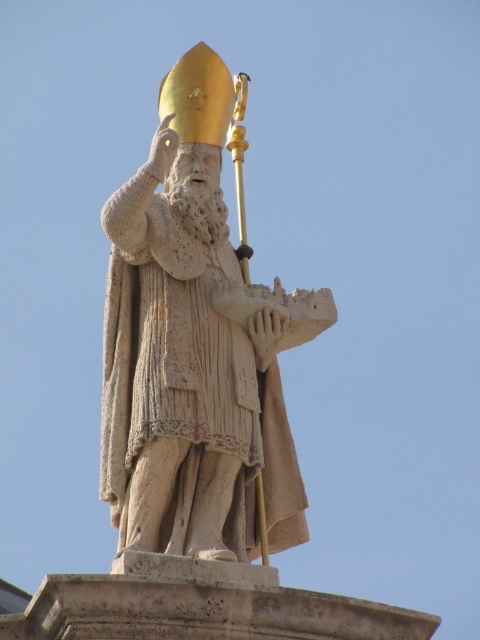
Question: Which of the following is the farthest from the observer?

Choices:
 (A) gold polished head at upper center
 (B) matte stone statue at center

Answer: (A)

Question: Is matte stone statue at center bigger than gold polished head at upper center?

Choices:
 (A) yes
 (B) no

Answer: (A)

Question: Which point is closer to the camera?

Choices:
 (A) (282, 509)
 (B) (188, 186)

Answer: (A)

Question: Can you confirm if matte stone statue at center is positioned to the right of gold polished head at upper center?

Choices:
 (A) no
 (B) yes

Answer: (B)

Question: Can you confirm if matte stone statue at center is positioned to the left of gold polished head at upper center?

Choices:
 (A) yes
 (B) no

Answer: (B)